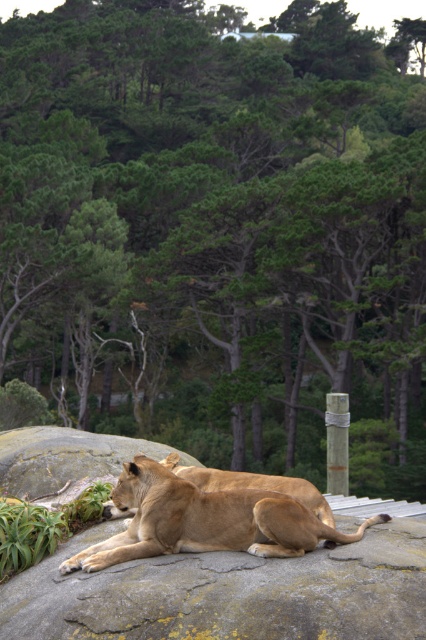
You are a park ranger observing the lions and the pole in the image. You need to place a protective barrier around the metallic gray pole at center right. To ensure safety, the barrier must be placed directly below the golden fur lion at center. Is this possible based on their positions?

The golden fur lion at center is located above the metallic gray pole at center right, so placing the barrier directly below the golden fur lion at center would naturally position it around the metallic gray pole at center right. This placement is feasible as their vertical alignment allows the barrier to be placed appropriately.